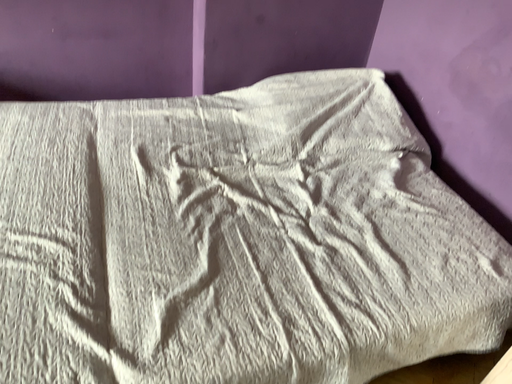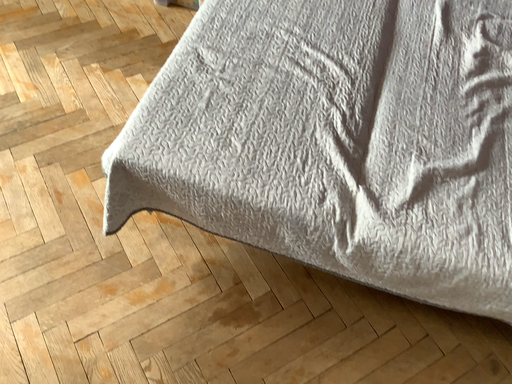
Question: How did the camera likely rotate when shooting the video?

Choices:
 (A) rotated downward
 (B) rotated upward

Answer: (A)